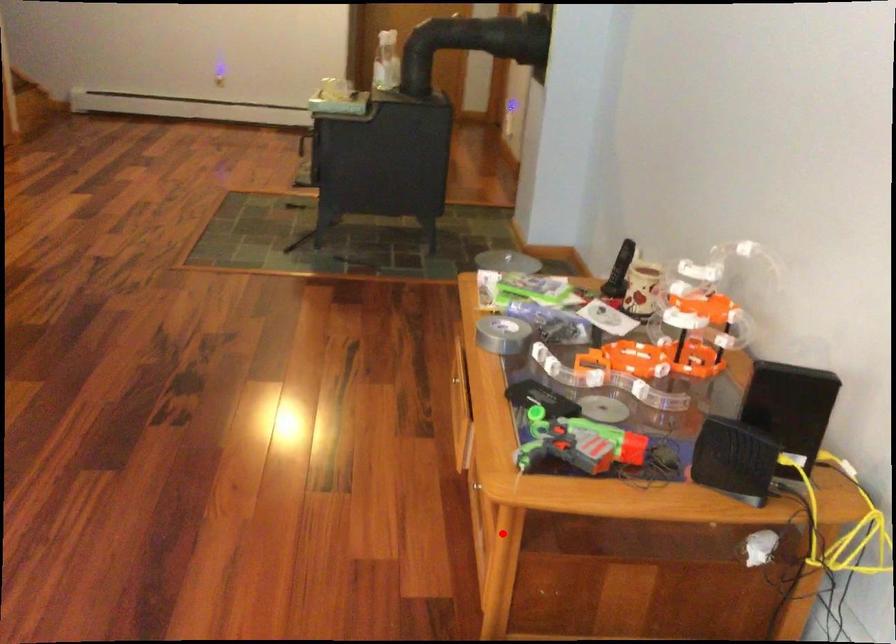
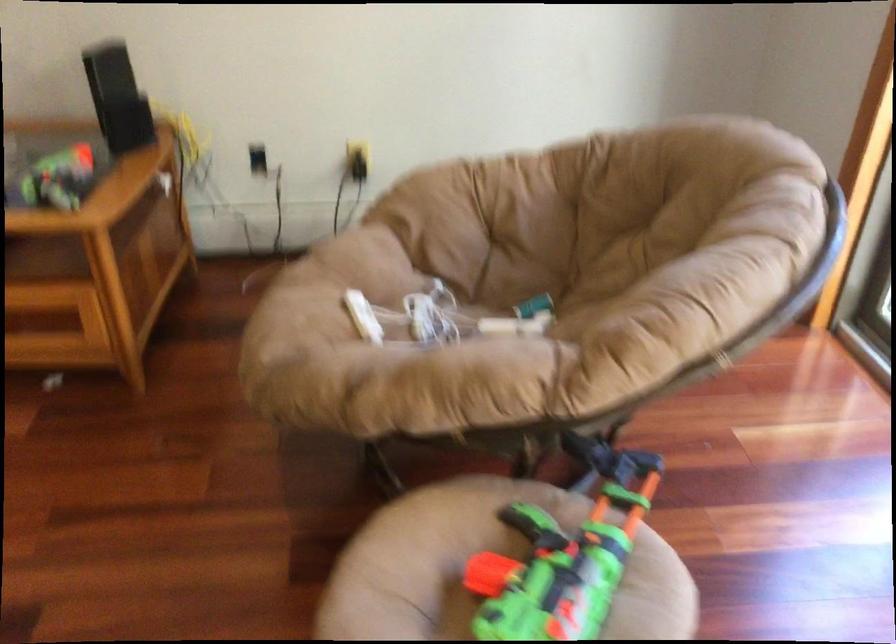
Question: I am providing you with two images of the same scene from different viewpoints. Given a red point in image1, look at the same physical point in image2. Is it:

Choices:
 (A) Closer to the viewpoint
 (B) Farther from the viewpoint

Answer: (B)